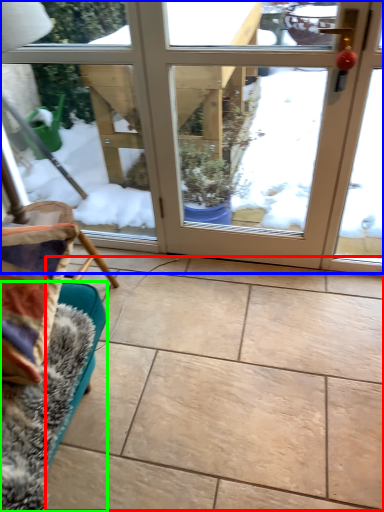
Question: Which object is positioned closest to ceramic tile (highlighted by a red box)? Select from door (highlighted by a blue box) and furniture (highlighted by a green box).

Choices:
 (A) door
 (B) furniture

Answer: (B)